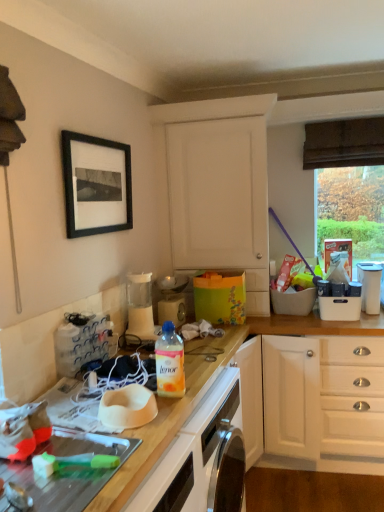
Question: Considering the relative sizes of white matte cabinet at upper center and white glossy oven at lower center in the image provided, is white matte cabinet at upper center wider than white glossy oven at lower center?

Choices:
 (A) yes
 (B) no

Answer: (B)

Question: Is white matte cabinet at upper center outside white glossy oven at lower center?

Choices:
 (A) no
 (B) yes

Answer: (B)

Question: Can you confirm if white matte cabinet at upper center is shorter than white glossy oven at lower center?

Choices:
 (A) no
 (B) yes

Answer: (A)

Question: Considering the relative sizes of white matte cabinet at upper center and white glossy oven at lower center in the image provided, is white matte cabinet at upper center taller than white glossy oven at lower center?

Choices:
 (A) no
 (B) yes

Answer: (B)

Question: Is white matte cabinet at upper center far from white glossy oven at lower center?

Choices:
 (A) no
 (B) yes

Answer: (B)

Question: Considering their positions, is white glossy oven at lower center located in front of or behind white matte cabinet at upper center?

Choices:
 (A) behind
 (B) front

Answer: (B)

Question: In terms of size, does white glossy oven at lower center appear bigger or smaller than white matte cabinet at upper center?

Choices:
 (A) big
 (B) small

Answer: (B)

Question: Is point (226, 406) positioned closer to the camera than point (185, 176)?

Choices:
 (A) closer
 (B) farther

Answer: (A)

Question: Based on their positions, is white glossy oven at lower center located to the left or right of white matte cabinet at upper center?

Choices:
 (A) right
 (B) left

Answer: (B)

Question: In the image, is white plastic container at upper right, acting as the second appliance starting from the left, on the left side or the right side of matte plastic blender at center, the 1th appliance positioned from the left?

Choices:
 (A) left
 (B) right

Answer: (B)

Question: In terms of height, does white plastic container at upper right, acting as the second appliance starting from the left, look taller or shorter compared to matte plastic blender at center, the 1th appliance positioned from the left?

Choices:
 (A) short
 (B) tall

Answer: (B)

Question: Is point (377, 288) closer or farther from the camera than point (168, 289)?

Choices:
 (A) closer
 (B) farther

Answer: (A)

Question: Which is correct: white plastic container at upper right, the 1th appliance when ordered from right to left, is inside matte plastic blender at center, which is the second appliance from right to left, or outside of it?

Choices:
 (A) outside
 (B) inside

Answer: (A)

Question: Would you say translucent plastic bottle at center is to the left or to the right of white plastic container at upper right, the 1th appliance when ordered from right to left, in the picture?

Choices:
 (A) left
 (B) right

Answer: (A)

Question: Is point (165, 330) positioned closer to the camera than point (375, 278)?

Choices:
 (A) farther
 (B) closer

Answer: (B)